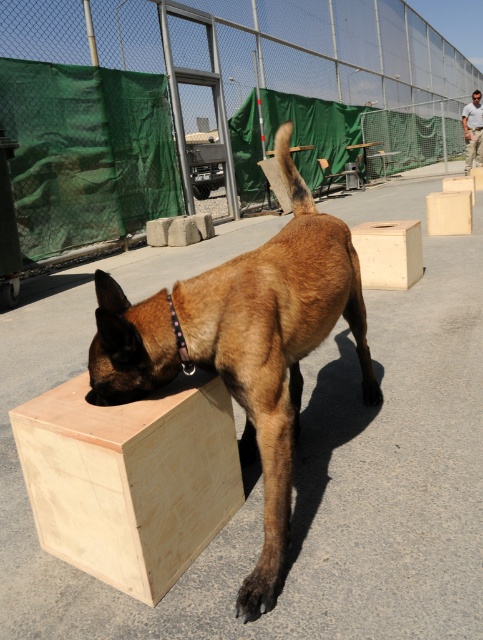
Who is positioned more to the left, brown wooden dog at center or plywood box at center?

brown wooden dog at center

What are the coordinates of `brown wooden dog at center` in the screenshot? It's located at (243, 346).

Between brown wooden dog at center and light brown wood at center, which one has more height?

brown wooden dog at center

Does brown wooden dog at center come in front of light brown wood at center?

Yes, it is in front of light brown wood at center.

Is point (286, 502) positioned before point (455, 225)?

Yes, it is.

Identify the location of brown wooden dog at center. Image resolution: width=483 pixels, height=640 pixels. (243, 346).

Between light brown wood at lower left and light brown wood at center, which one appears on the right side from the viewer's perspective?

light brown wood at center is more to the right.

Is light brown wood at lower left to the left of light brown wood at center from the viewer's perspective?

Yes, light brown wood at lower left is to the left of light brown wood at center.

Describe the element at coordinates (129, 477) in the screenshot. I see `light brown wood at lower left` at that location.

At what (x,y) coordinates should I click in order to perform the action: click on light brown wood at lower left. Please return your answer as a coordinate pair (x, y). This screenshot has width=483, height=640. Looking at the image, I should click on (129, 477).